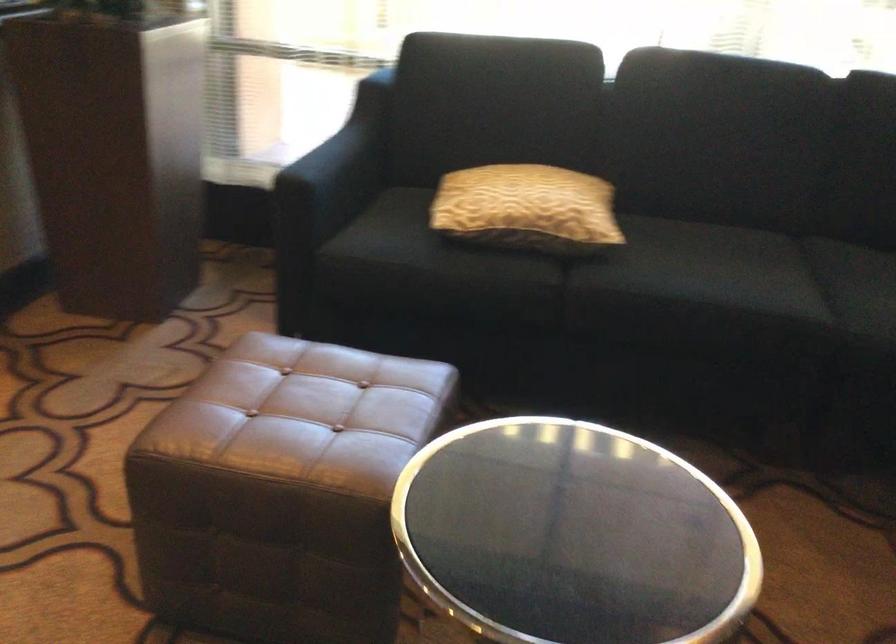
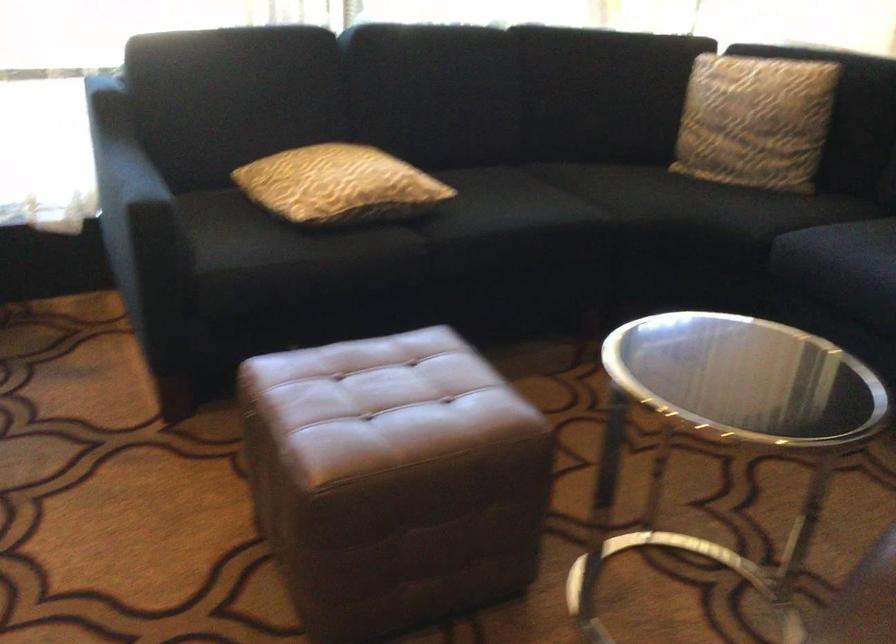
The point at [498,203] is marked in the first image. Where is the corresponding point in the second image?

(339, 185)